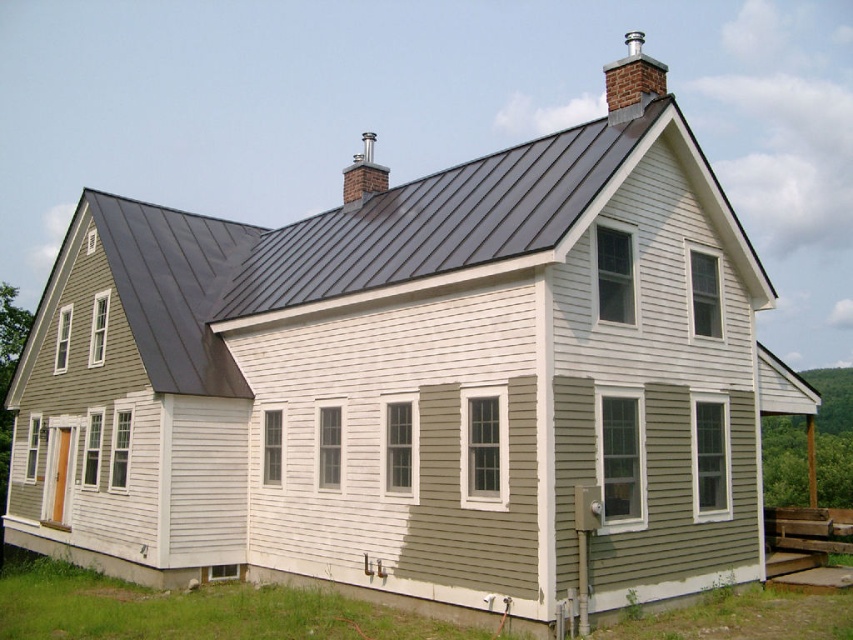
You are standing in front of the house and want to locate both the silver metallic chimney at upper right and the smooth silver chimney at upper center. Which one is positioned further to the right side of the roof?

The silver metallic chimney at upper right is positioned further to the right side of the roof compared to the smooth silver chimney at upper center.

Looking at this image, you are standing in front of the house and notice a point marked at coordinates (631, 81). Based on the house description, can you identify which part of the house this point corresponds to?

The point at coordinates (631, 81) is on the silver metallic chimney at upper right.